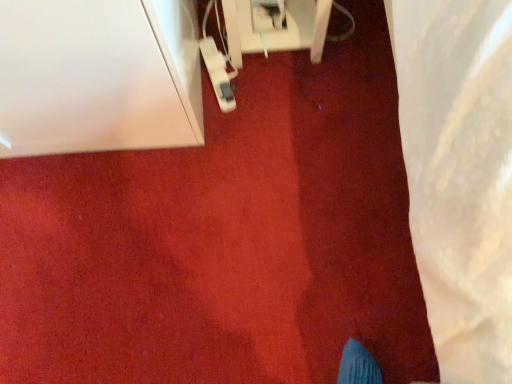
Where is `white plastic equipment at center`? The image size is (512, 384). white plastic equipment at center is located at coordinates (302, 28).

Describe the element at coordinates (302, 28) in the screenshot. This screenshot has width=512, height=384. I see `white plastic equipment at center` at that location.

I want to click on white plastic equipment at center, so click(x=302, y=28).